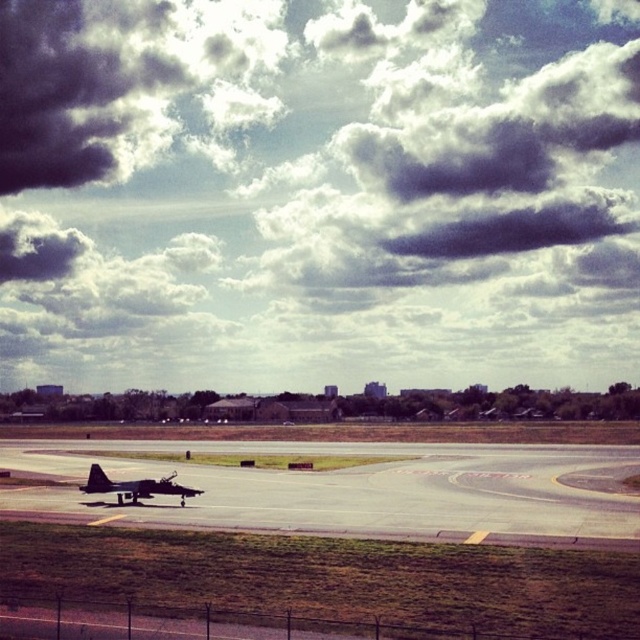
Question: Which point appears farthest from the camera in this image?

Choices:
 (A) (122, 490)
 (B) (241, 372)
 (C) (595, 452)

Answer: (B)

Question: Can you confirm if dark gray cloud at upper center is positioned below shiny black jet at center?

Choices:
 (A) no
 (B) yes

Answer: (A)

Question: Can you confirm if smooth asphalt runway at lower center is smaller than shiny black jet at center?

Choices:
 (A) no
 (B) yes

Answer: (A)

Question: Which of the following is the closest to the observer?

Choices:
 (A) (148, 497)
 (B) (440, 72)
 (C) (296, 502)

Answer: (C)

Question: Considering the real-world distances, which object is farthest from the smooth asphalt runway at lower center?

Choices:
 (A) shiny black jet at center
 (B) dark gray cloud at upper center

Answer: (B)

Question: In this image, where is dark gray cloud at upper center located relative to smooth asphalt runway at lower center?

Choices:
 (A) above
 (B) below

Answer: (A)